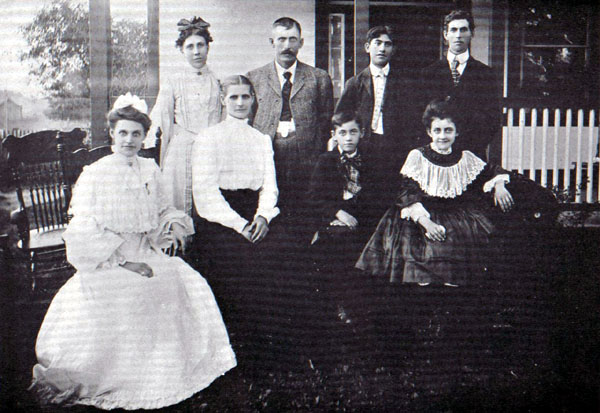
Find the location of a particular element. window is located at coordinates pos(337,53), pos(545,63).